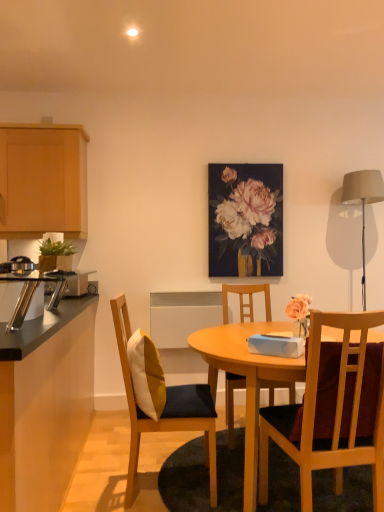
This screenshot has height=512, width=384. Identify the location of free space above floral bouquet at center (from a real-world perspective). (254, 158).